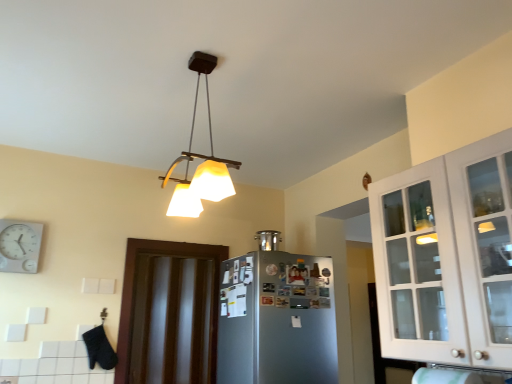
Describe the element at coordinates (19, 246) in the screenshot. I see `white plastic clock at upper left` at that location.

In order to click on satin silver pot at upper center in this screenshot , I will do `click(268, 240)`.

Describe the element at coordinates (200, 158) in the screenshot. The width and height of the screenshot is (512, 384). I see `matte white lampshade at upper center` at that location.

I want to click on satin silver refrigerator at center, so click(277, 320).

Measure the distance between dark wood door at center and camera.

dark wood door at center is 2.77 meters from camera.

Identify the location of white plastic clock at upper left. click(x=19, y=246).

Does matte white lampshade at upper center come behind satin silver refrigerator at center?

No, it is not.

How different are the orientations of matte white lampshade at upper center and satin silver refrigerator at center in degrees?

The angle between the facing direction of matte white lampshade at upper center and the facing direction of satin silver refrigerator at center is 95 degrees.

Is matte white lampshade at upper center taller or shorter than satin silver refrigerator at center?

Considering their sizes, matte white lampshade at upper center has less height than satin silver refrigerator at center.

Is matte white lampshade at upper center turned away from satin silver refrigerator at center?

No, satin silver refrigerator at center is not at the back of matte white lampshade at upper center.

The width and height of the screenshot is (512, 384). In order to click on cabinetry above the satin silver refrigerator at center (from the image's perspective) in this screenshot , I will do `click(447, 257)`.

Is white glass cabinet at upper right situated inside satin silver refrigerator at center or outside?

white glass cabinet at upper right exists outside the volume of satin silver refrigerator at center.

Which point is more distant from viewer, (421, 227) or (296, 353)?

The point (296, 353) is behind.

Does white glass cabinet at upper right have a greater height compared to satin silver refrigerator at center?

No, white glass cabinet at upper right is not taller than satin silver refrigerator at center.

Which object is further away from the camera, white glass cabinet at upper right or dark wood door at center?

dark wood door at center is behind.

Between point (482, 308) and point (182, 244), which one is positioned in front?

The point (482, 308) is closer to the camera.

Can you tell me how much white glass cabinet at upper right and dark wood door at center differ in facing direction?

89.7 degrees.

Considering the relative sizes of white glass cabinet at upper right and dark wood door at center in the image provided, is white glass cabinet at upper right wider than dark wood door at center?

Correct, the width of white glass cabinet at upper right exceeds that of dark wood door at center.

Relative to matte white lampshade at upper center, is satin silver pot at upper center in front or behind?

In the image, satin silver pot at upper center appears behind matte white lampshade at upper center.

Looking at this image, is satin silver pot at upper center next to matte white lampshade at upper center?

There is a gap between satin silver pot at upper center and matte white lampshade at upper center.

Is satin silver pot at upper center smaller than matte white lampshade at upper center?

Correct, satin silver pot at upper center occupies less space than matte white lampshade at upper center.

This screenshot has height=384, width=512. I want to click on appliance below the matte white lampshade at upper center (from the image's perspective), so click(x=268, y=240).

Considering their positions, is satin silver pot at upper center located in front of or behind dark wood door at center?

satin silver pot at upper center is behind dark wood door at center.

Does satin silver pot at upper center contain dark wood door at center?

No, satin silver pot at upper center does not contain dark wood door at center.

Who is shorter, satin silver pot at upper center or dark wood door at center?

Standing shorter between the two is satin silver pot at upper center.

Considering the relative sizes of satin silver pot at upper center and dark wood door at center in the image provided, is satin silver pot at upper center wider than dark wood door at center?

Yes.

Does white glass cabinet at upper right come in front of white plastic clock at upper left?

Yes, white glass cabinet at upper right is in front of white plastic clock at upper left.

Is white glass cabinet at upper right placed right next to white plastic clock at upper left?

white glass cabinet at upper right and white plastic clock at upper left are clearly separated.

From a real-world perspective, is white glass cabinet at upper right physically located above or below white plastic clock at upper left?

white glass cabinet at upper right is below white plastic clock at upper left.

Between white glass cabinet at upper right and satin silver pot at upper center, which one has larger size?

With larger size is white glass cabinet at upper right.

What's the angular difference between white glass cabinet at upper right and satin silver pot at upper center's facing directions?

The facing directions of white glass cabinet at upper right and satin silver pot at upper center are 88.7 degrees apart.

From the image's perspective, between white glass cabinet at upper right and satin silver pot at upper center, which one is located above?

white glass cabinet at upper right is shown above in the image.

At what (x,y) coordinates should I click in order to perform the action: click on lamp positioned vertically above the satin silver refrigerator at center (from a real-world perspective). Please return your answer as a coordinate pair (x, y). Image resolution: width=512 pixels, height=384 pixels. Looking at the image, I should click on (200, 158).

At what (x,y) coordinates should I click in order to perform the action: click on cabinetry that is above the satin silver refrigerator at center (from the image's perspective). Please return your answer as a coordinate pair (x, y). Image resolution: width=512 pixels, height=384 pixels. Looking at the image, I should click on (447, 257).

From the image, which object appears to be nearer to satin silver pot at upper center, matte white lampshade at upper center or white glass cabinet at upper right?

matte white lampshade at upper center is positioned closer to the anchor satin silver pot at upper center.

Estimate the real-world distances between objects in this image. Which object is further from white glass cabinet at upper right, satin silver pot at upper center or satin silver refrigerator at center?

satin silver pot at upper center lies further to white glass cabinet at upper right than the other object.

Which object lies further to the anchor point matte white lampshade at upper center, satin silver pot at upper center or dark wood door at center?

The object further to matte white lampshade at upper center is satin silver pot at upper center.

Looking at the image, which one is located closer to satin silver refrigerator at center, matte white lampshade at upper center or dark wood door at center?

dark wood door at center is positioned closer to the anchor satin silver refrigerator at center.

Which object lies further to the anchor point dark wood door at center, matte white lampshade at upper center or white glass cabinet at upper right?

Among the two, white glass cabinet at upper right is located further to dark wood door at center.

When comparing their distances from white plastic clock at upper left, does matte white lampshade at upper center or dark wood door at center seem closer?

dark wood door at center.

When comparing their distances from white plastic clock at upper left, does satin silver pot at upper center or satin silver refrigerator at center seem closer?

Among the two, satin silver refrigerator at center is located nearer to white plastic clock at upper left.

When comparing their distances from white glass cabinet at upper right, does satin silver pot at upper center or white plastic clock at upper left seem closer?

The object closer to white glass cabinet at upper right is satin silver pot at upper center.

Identify the location of lamp between white plastic clock at upper left and white glass cabinet at upper right in the horizontal direction. This screenshot has width=512, height=384. (200, 158).

You are a GUI agent. You are given a task and a screenshot of the screen. Output one action in this format:
    pyautogui.click(x=<x>, y=<y>)
    Task: Click on the fridge between matte white lampshade at upper center and satin silver pot at upper center along the z-axis
    
    Given the screenshot: What is the action you would take?
    pyautogui.click(x=277, y=320)

This screenshot has height=384, width=512. Identify the location of lamp between white glass cabinet at upper right and satin silver pot at upper center along the z-axis. (200, 158).

The height and width of the screenshot is (384, 512). I want to click on lamp positioned between white glass cabinet at upper right and satin silver refrigerator at center from near to far, so click(200, 158).